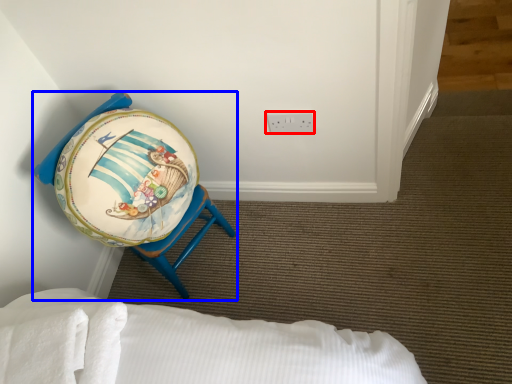
Question: Which point is further to the camera, electric outlet (highlighted by a red box) or furniture (highlighted by a blue box)?

Choices:
 (A) electric outlet
 (B) furniture

Answer: (A)